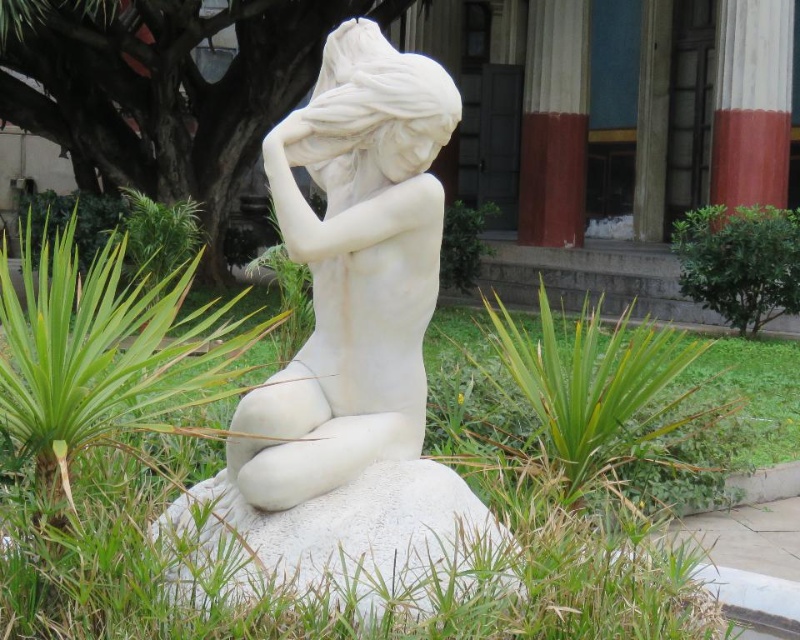
Is white marble statue at center taller than green leafy plant at center?

Correct, white marble statue at center is much taller as green leafy plant at center.

Measure the distance between point (260, 577) and camera.

Point (260, 577) and camera are 2.02 meters apart.

In order to click on white marble statue at center in this screenshot , I will do `click(350, 352)`.

Does green leafy bush at right have a larger size compared to green leafy plant at center?

Yes.

Who is positioned more to the left, green leafy bush at right or green leafy plant at center?

Positioned to the left is green leafy plant at center.

Who is more forward, (680, 228) or (466, 230)?

Positioned in front is point (680, 228).

The image size is (800, 640). Identify the location of green leafy bush at right. (740, 262).

Can you confirm if white marble statue at center is thinner than green leafy bush at right?

Yes.

Which is behind, point (440, 532) or point (784, 243)?

Positioned behind is point (784, 243).

Where is `white marble statue at center`? The width and height of the screenshot is (800, 640). white marble statue at center is located at coordinates (350, 352).